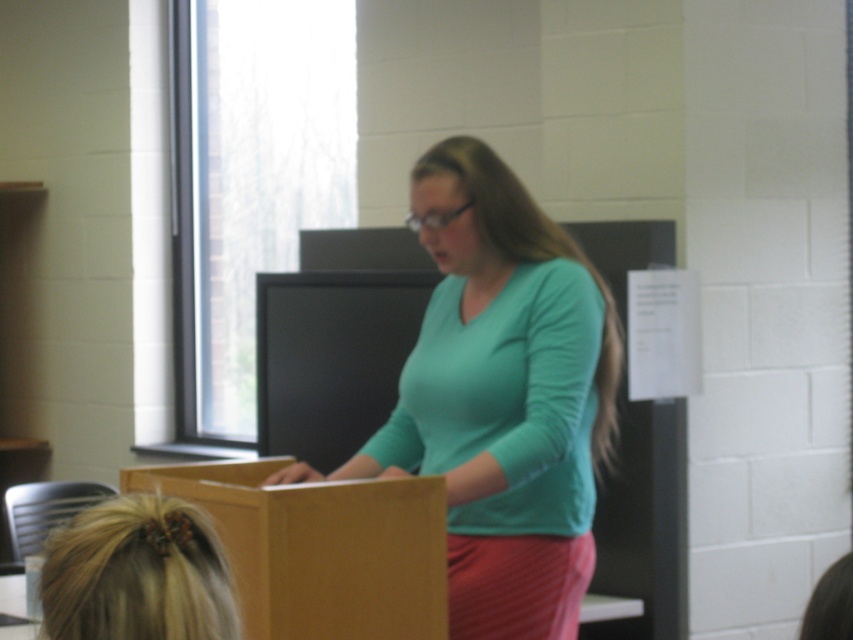
Is teal matte shirt at center thinner than blonde hair at lower left?

No, teal matte shirt at center is not thinner than blonde hair at lower left.

Is teal matte shirt at center above blonde hair at lower left?

Yes, teal matte shirt at center is above blonde hair at lower left.

Find the location of `teal matte shirt at center`. teal matte shirt at center is located at coordinates (502, 397).

Between matte brown cardboard box at center and blonde hair at lower left, which one has less height?

With less height is blonde hair at lower left.

Looking at this image, who is more distant from viewer, (372, 534) or (97, 508)?

The point (372, 534) is behind.

Which is behind, point (347, 522) or point (74, 627)?

Point (347, 522)

Where is `matte brown cardboard box at center`? The image size is (853, 640). matte brown cardboard box at center is located at coordinates (321, 548).

Find the location of a particular element. The width and height of the screenshot is (853, 640). teal matte shirt at center is located at coordinates (502, 397).

I want to click on teal matte shirt at center, so click(x=502, y=397).